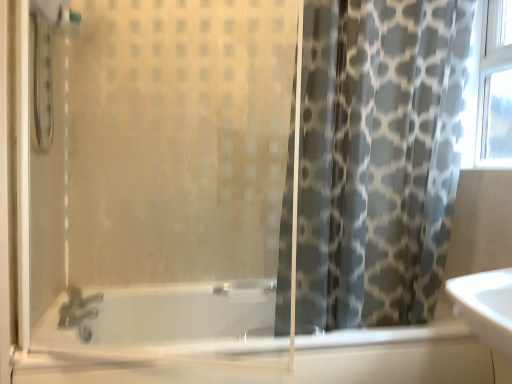
What do you see at coordinates (162, 184) in the screenshot? Image resolution: width=512 pixels, height=384 pixels. I see `transparent glass shower door at left` at bounding box center [162, 184].

Describe the element at coordinates (378, 157) in the screenshot. I see `gray fabric curtain at right` at that location.

In order to click on transparent glass shower door at left in this screenshot , I will do `click(162, 184)`.

Which point is more forward, (395, 85) or (114, 290)?

The point (395, 85) is more forward.

In the scene shown: Is gray fabric curtain at right facing away from transparent glass shower door at left?

No, transparent glass shower door at left is not at the back of gray fabric curtain at right.

From a real-world perspective, which object stands above the other?

From a 3D spatial view, gray fabric curtain at right is above.

How different are the orientations of gray fabric curtain at right and transparent glass shower door at left in degrees?

The angular difference between gray fabric curtain at right and transparent glass shower door at left is 18.3 degrees.

Is transparent glass shower door at left not close to translucent glass bathtub at lower center?

That's not correct — transparent glass shower door at left is a little close to translucent glass bathtub at lower center.

Is transparent glass shower door at left facing away from translucent glass bathtub at lower center?

That's not correct — transparent glass shower door at left is not looking away from translucent glass bathtub at lower center.

Looking at this image, from the image's perspective, is transparent glass shower door at left located above translucent glass bathtub at lower center?

Yes, from the image's perspective, transparent glass shower door at left is over translucent glass bathtub at lower center.

Is transparent glass shower door at left at the right side of translucent glass bathtub at lower center?

No.

Is translucent glass bathtub at lower center looking in the opposite direction of gray fabric curtain at right?

No, translucent glass bathtub at lower center's orientation is not away from gray fabric curtain at right.

Are translucent glass bathtub at lower center and gray fabric curtain at right far apart?

No, translucent glass bathtub at lower center is not far away from gray fabric curtain at right.

Would you say translucent glass bathtub at lower center is inside or outside gray fabric curtain at right?

translucent glass bathtub at lower center is not inside gray fabric curtain at right, it's outside.

Which object is wider, translucent glass bathtub at lower center or gray fabric curtain at right?

translucent glass bathtub at lower center is wider.

Locate an element on the screen. This screenshot has width=512, height=384. curtain behind the translucent glass bathtub at lower center is located at coordinates (378, 157).

How different are the orientations of gray fabric curtain at right and translucent glass bathtub at lower center in degrees?

0.263 degrees separate the facing orientations of gray fabric curtain at right and translucent glass bathtub at lower center.

Between gray fabric curtain at right and translucent glass bathtub at lower center, which one appears on the left side from the viewer's perspective?

Positioned to the left is translucent glass bathtub at lower center.

Is translucent glass bathtub at lower center wider than transparent glass shower door at left?

Indeed, translucent glass bathtub at lower center has a greater width compared to transparent glass shower door at left.

From a real-world perspective, is translucent glass bathtub at lower center positioned above or below transparent glass shower door at left?

In terms of real-world spatial position, translucent glass bathtub at lower center is below transparent glass shower door at left.

Considering the sizes of objects translucent glass bathtub at lower center and transparent glass shower door at left in the image provided, who is taller, translucent glass bathtub at lower center or transparent glass shower door at left?

transparent glass shower door at left is taller.

Which is correct: translucent glass bathtub at lower center is inside transparent glass shower door at left, or outside of it?

translucent glass bathtub at lower center exists outside the volume of transparent glass shower door at left.

Considering the positions of objects transparent glass shower door at left and gray fabric curtain at right in the image provided, who is more to the right, transparent glass shower door at left or gray fabric curtain at right?

gray fabric curtain at right.

Considering the relative positions of transparent glass shower door at left and gray fabric curtain at right in the image provided, is transparent glass shower door at left in front of gray fabric curtain at right?

Yes, the depth of transparent glass shower door at left is less than that of gray fabric curtain at right.

Is transparent glass shower door at left thinner than gray fabric curtain at right?

Yes, transparent glass shower door at left is thinner than gray fabric curtain at right.

Could you tell me if transparent glass shower door at left is turned towards gray fabric curtain at right?

No, transparent glass shower door at left does not turn towards gray fabric curtain at right.

Image resolution: width=512 pixels, height=384 pixels. I want to click on screen door below the gray fabric curtain at right (from a real-world perspective), so 162,184.

Image resolution: width=512 pixels, height=384 pixels. What are the coordinates of `screen door in front of the translucent glass bathtub at lower center` in the screenshot? It's located at (162, 184).

Based on their spatial positions, is transparent glass shower door at left or gray fabric curtain at right further from translucent glass bathtub at lower center?

gray fabric curtain at right.

In the scene shown: When comparing their distances from transparent glass shower door at left, does translucent glass bathtub at lower center or gray fabric curtain at right seem further?

gray fabric curtain at right is positioned further to the anchor transparent glass shower door at left.

Looking at the image, which one is located further to transparent glass shower door at left, gray fabric curtain at right or translucent glass bathtub at lower center?

gray fabric curtain at right.

Estimate the real-world distances between objects in this image. Which object is closer to gray fabric curtain at right, transparent glass shower door at left or translucent glass bathtub at lower center?

transparent glass shower door at left.

Estimate the real-world distances between objects in this image. Which object is further from gray fabric curtain at right, translucent glass bathtub at lower center or transparent glass shower door at left?

translucent glass bathtub at lower center is further to gray fabric curtain at right.

From the image, which object appears to be nearer to translucent glass bathtub at lower center, gray fabric curtain at right or transparent glass shower door at left?

The object closer to translucent glass bathtub at lower center is transparent glass shower door at left.

Locate an element on the screen. This screenshot has width=512, height=384. screen door between gray fabric curtain at right and translucent glass bathtub at lower center from top to bottom is located at coordinates (162, 184).